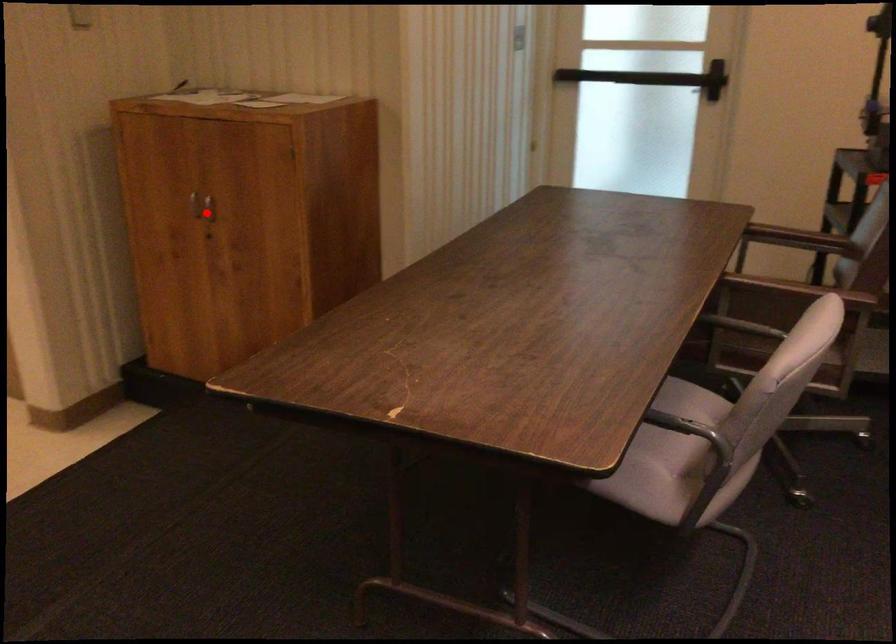
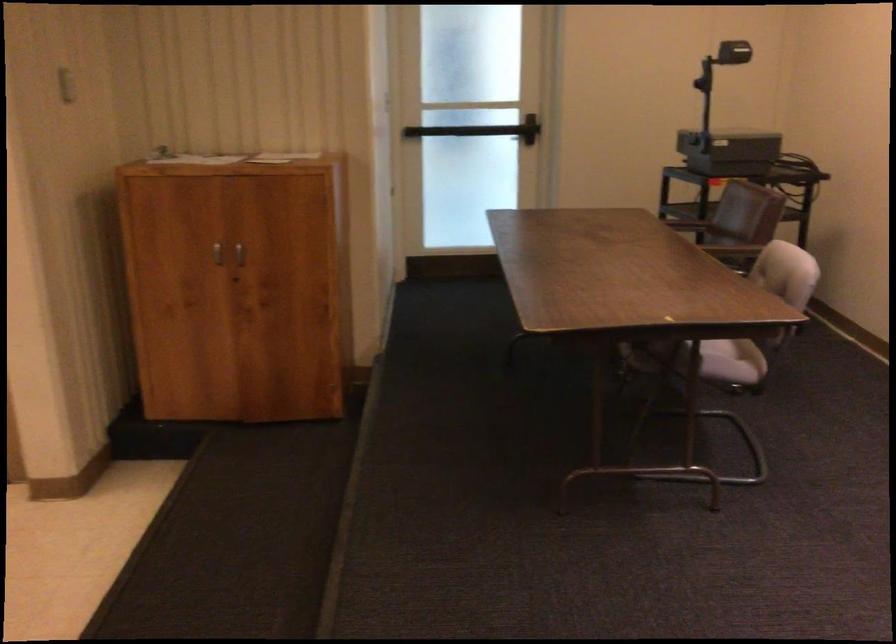
Question: I am providing you with two images of the same scene from different viewpoints. In image1, a red point is highlighted. Considering the same 3D point in image2, which of the following is correct?

Choices:
 (A) It is closer
 (B) It is farther

Answer: (B)